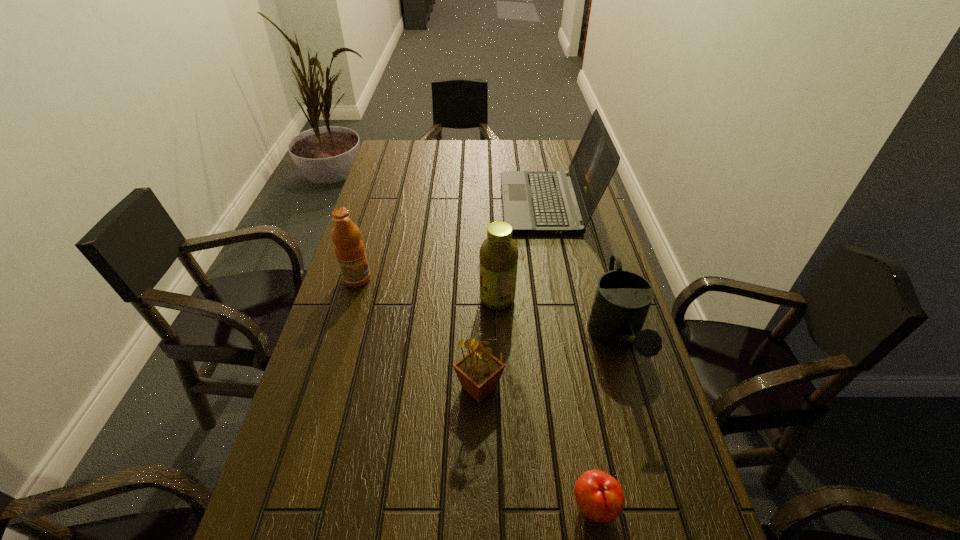
The image size is (960, 540). In order to click on vacant region between the watering can and the laptop_computer in this screenshot , I will do pyautogui.click(x=582, y=272).

Where is `free space between the shortest object and the watering can`? free space between the shortest object and the watering can is located at coordinates (606, 423).

Find the location of a particular element. This screenshot has width=960, height=540. free area in between the laptop_computer and the right fruit juice is located at coordinates (522, 252).

Where is `object identified as the second closest to the sunflower`? object identified as the second closest to the sunflower is located at coordinates (599, 496).

This screenshot has height=540, width=960. I want to click on object that is the fifth closest to the left fruit juice, so click(x=599, y=496).

Locate an element on the screen. vacant space that satisfies the following two spatial constraints: 1. on the front label of the right fruit juice; 2. at the front of the sunflower with flowers visible is located at coordinates (501, 387).

Find the location of a particular element. This screenshot has width=960, height=540. vacant area that satisfies the following two spatial constraints: 1. on the back side of the shortest object; 2. on the front label of the right fruit juice is located at coordinates (558, 299).

The height and width of the screenshot is (540, 960). I want to click on vacant space that satisfies the following two spatial constraints: 1. on the front label of the shortest object; 2. on the right side of the right fruit juice, so click(506, 506).

Locate an element on the screen. vacant area in the image that satisfies the following two spatial constraints: 1. on the label side of the left fruit juice; 2. on the right side of the nearest object is located at coordinates (290, 506).

The image size is (960, 540). What are the coordinates of `vacant region that satisfies the following two spatial constraints: 1. on the front label of the right fruit juice; 2. on the left side of the shortest object` in the screenshot? It's located at (506, 506).